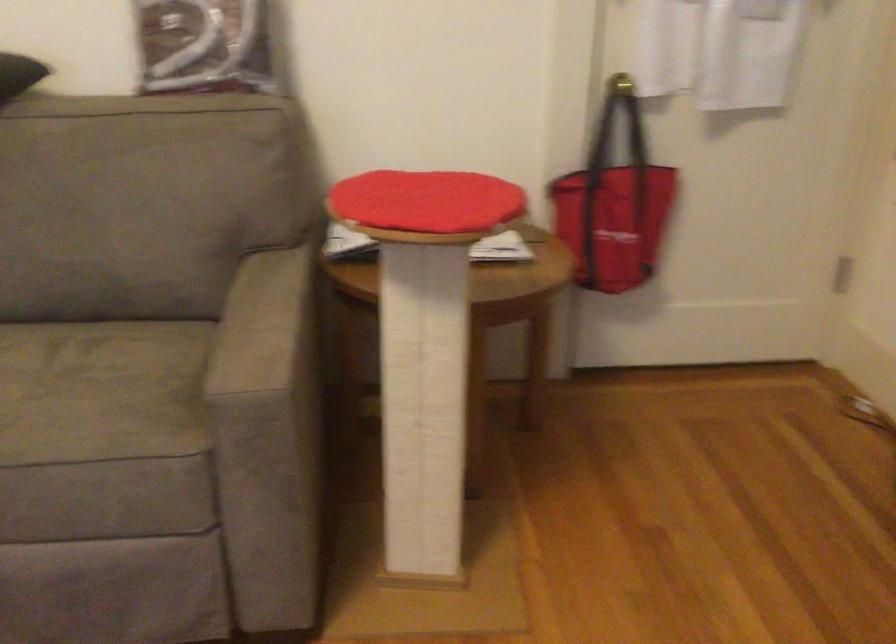
Where is `brass wall hook`? brass wall hook is located at coordinates (619, 84).